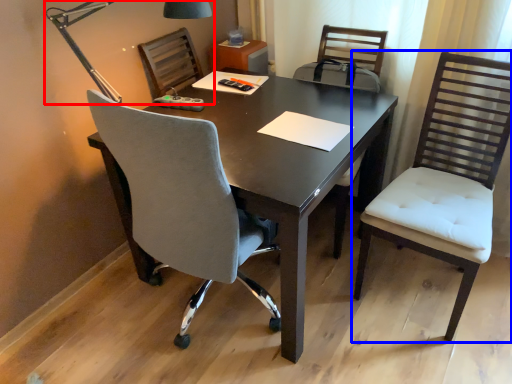
Question: Which point is closer to the camera, lamp (highlighted by a red box) or chair (highlighted by a blue box)?

Choices:
 (A) lamp
 (B) chair

Answer: (B)